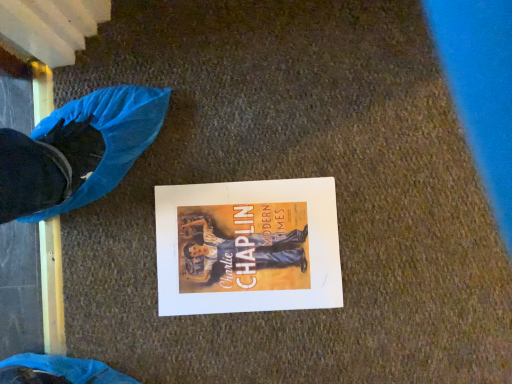
Find the location of a particular element. The image size is (512, 384). white paper poster at center is located at coordinates (247, 247).

What do you see at coordinates (247, 247) in the screenshot? The image size is (512, 384). I see `white paper poster at center` at bounding box center [247, 247].

This screenshot has height=384, width=512. Identify the location of white paper poster at center. (247, 247).